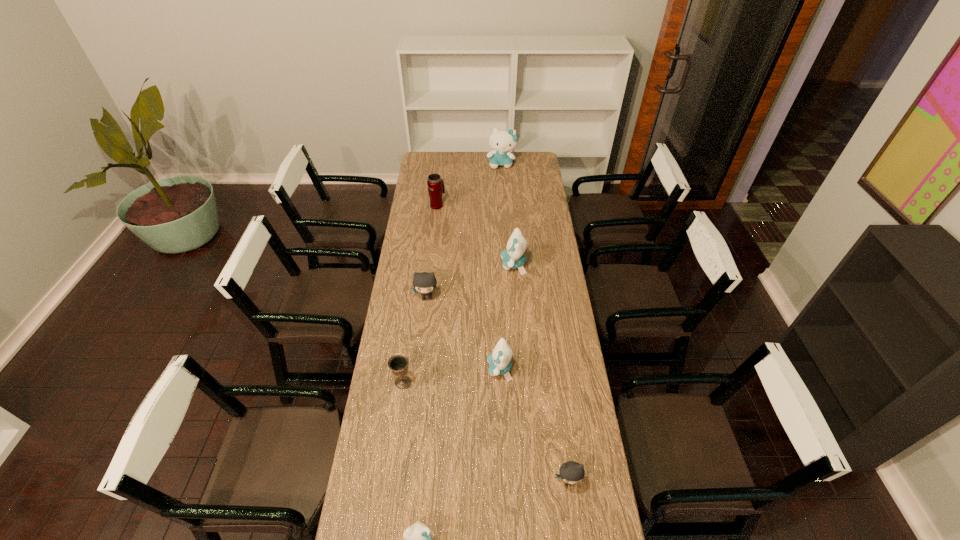
Locate an element on the screen. object that is at the far right corner is located at coordinates pos(502,141).

At what (x,y) coordinates should I click in order to perform the action: click on vacant space at the far edge of the desktop. Please return your answer as a coordinate pair (x, y). Looking at the image, I should click on (473, 166).

Locate an element on the screen. Image resolution: width=960 pixels, height=540 pixels. vacant space at the left edge of the desktop is located at coordinates (402, 426).

This screenshot has height=540, width=960. Find the location of `free space at the right edge`. free space at the right edge is located at coordinates (559, 525).

The width and height of the screenshot is (960, 540). Identify the location of vacant point located between the second nearest blue kitten and the fifth nearest kitten. (507, 317).

Locate an element on the screen. vacant point located between the red thermos bottle and the tallest object is located at coordinates (469, 185).

I want to click on unoccupied position between the farther gray kitten and the right gray kitten, so click(497, 389).

In order to click on vacant area that lies between the third nearest blue kitten and the bronze chalice in this screenshot , I will do `click(458, 324)`.

What are the coordinates of `unoccupied position between the nearer gray kitten and the bronze chalice` in the screenshot? It's located at (486, 432).

The height and width of the screenshot is (540, 960). I want to click on free spot between the tallest object and the sixth nearest object, so click(508, 214).